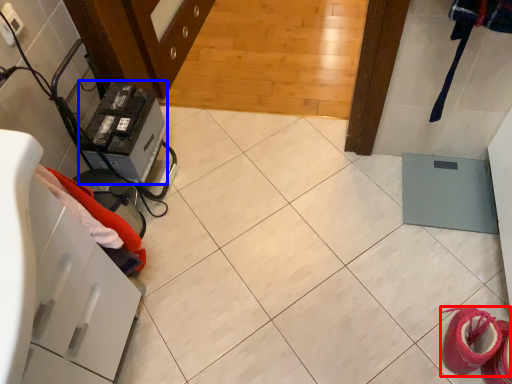
Question: Which of the following is the closest to the observer, footwear (highlighted by a red box) or appliance (highlighted by a blue box)?

Choices:
 (A) footwear
 (B) appliance

Answer: (A)